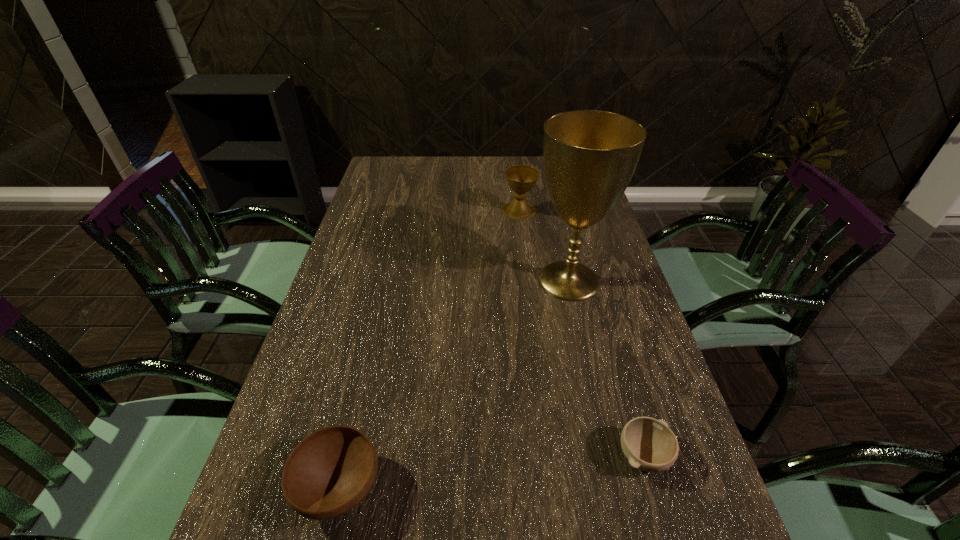
Find the location of a particular element. The image size is (960, 540). free spot between the taller bowl and the right bowl is located at coordinates (492, 472).

Identify the location of vacant area between the right bowl and the second farthest object. This screenshot has height=540, width=960. (606, 368).

You are a GUI agent. You are given a task and a screenshot of the screen. Output one action in this format:
    pyautogui.click(x=<x>, y=<y>)
    Task: Click on the empty space between the right bowl and the taller bowl
    The height and width of the screenshot is (540, 960).
    Given the screenshot: What is the action you would take?
    pyautogui.click(x=492, y=472)

Find the location of a particular element. The height and width of the screenshot is (540, 960). free spot between the trophy cup and the left bowl is located at coordinates (454, 384).

Identify the location of blank region between the right bowl and the second tallest object. click(581, 334).

In order to click on free space between the taller bowl and the tallest object in this screenshot , I will do `click(454, 384)`.

Find the location of a particular element. Image resolution: width=960 pixels, height=540 pixels. free space between the right bowl and the chalice is located at coordinates (581, 334).

Where is `vacant space that's between the chalice and the trophy cup`? The image size is (960, 540). vacant space that's between the chalice and the trophy cup is located at coordinates (544, 246).

Find the location of a particular element. object that ranks as the third closest to the farthest object is located at coordinates (330, 471).

Identify the location of the third closest object to the tallest object. Image resolution: width=960 pixels, height=540 pixels. (330, 471).